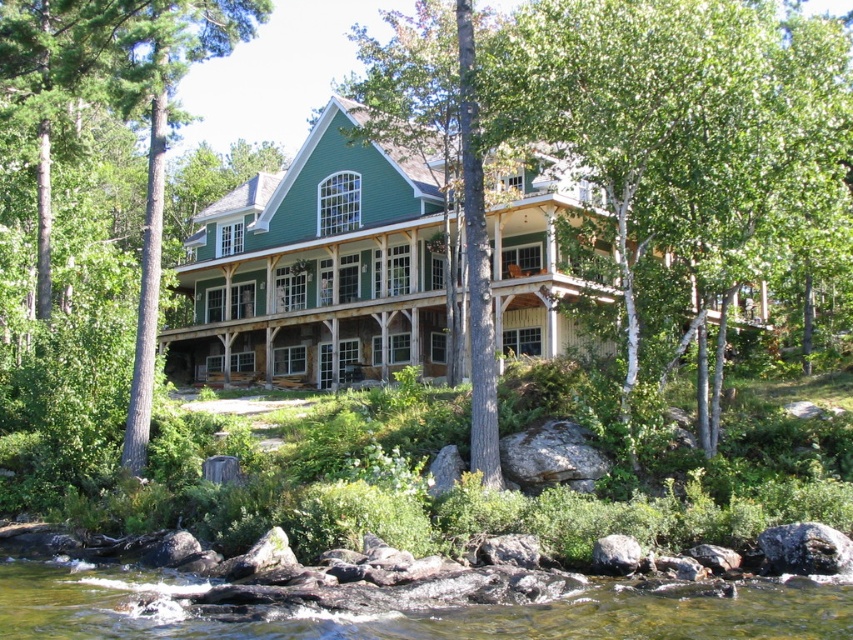
You are standing at the front door of the house and looking towards the forest. There are two points marked in the image, point 1 at coordinates point (x=384, y=252) and point 2 at coordinates point (x=88, y=628). Which point is closer to you?

Point (x=88, y=628) is closer to you because it is in front of point (x=384, y=252).

You are standing at the entrance of the house and want to reach the wooden porch at center. According to the coordinates provided, in which direction should you move relative to your current position?

The wooden porch at center is located at coordinates point (x=317, y=291). Since you are at the entrance, which is typically near the front of the house, moving towards the center area would mean heading towards the wooden porch at center. Therefore, you should move forward towards the wooden porch at center.